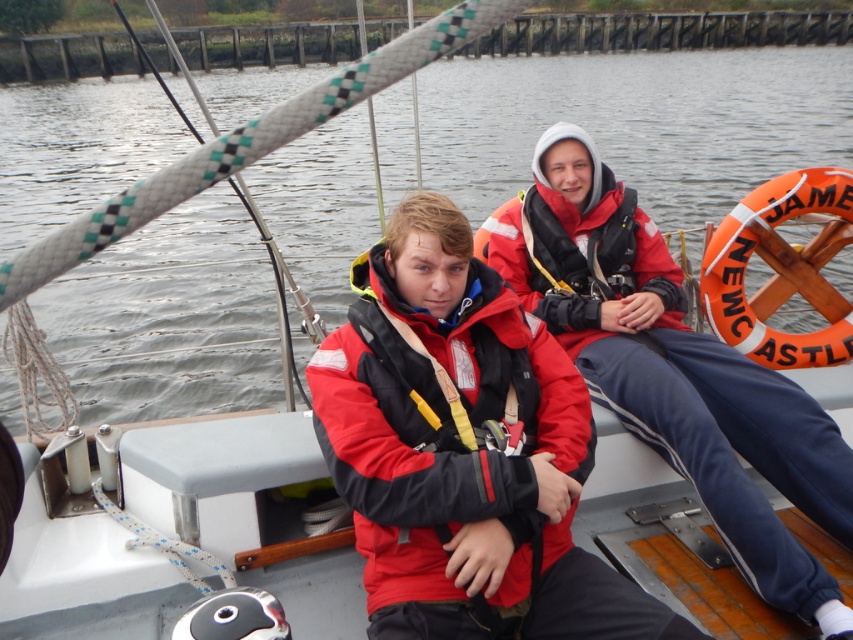
You are a safety inspector checking the boat for proper equipment placement. The red matte jacket at right and the red matte life jacket at center must be positioned according to safety regulations. Based on their current positions, is the life jacket stored correctly?

The red matte jacket at right is above the red matte life jacket at center, meaning the life jacket is stored underneath the jacket. According to safety regulations, life jackets should be easily accessible and not obstructed by other items. Therefore, the life jacket at center is not stored correctly and should be moved to a more accessible location free from obstruction.

From the picture: You are standing on the boat and want to move from the point at coordinates point (544, 266) to the point at coordinates point (373, 321). Which direction should you move in?

You should move towards the lower right direction because point (544, 266) is further to the viewer than point (373, 321), meaning the latter is closer to the front of the boat.